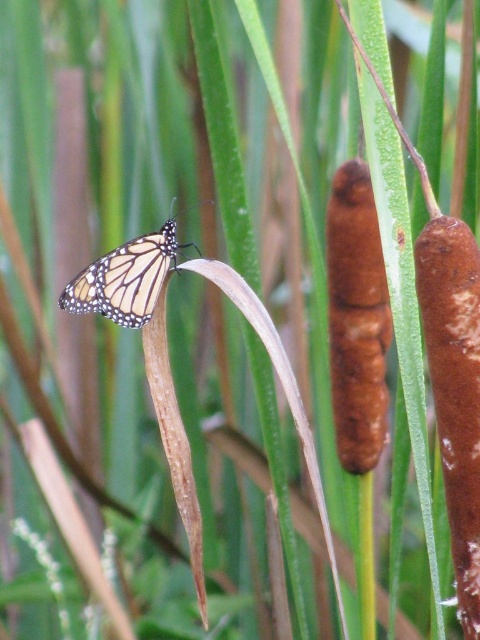
You are standing in a garden and see two points marked in the image. The first point is at coordinates point [355,426] and the second is at point [129,298]. Which point is closer to you?

Point [129,298] is closer to you because point [355,426] is behind it.